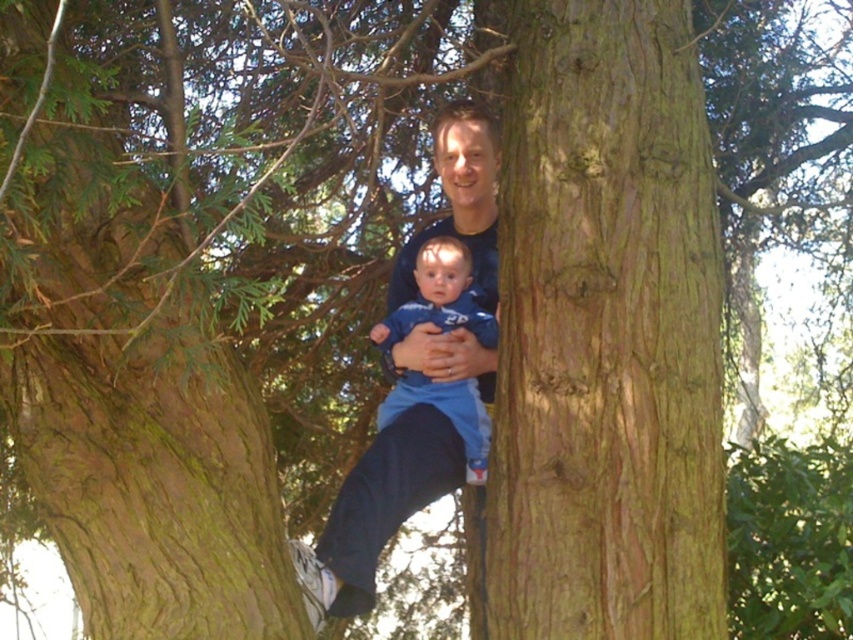
Can you confirm if dark blue shirt at center is shorter than blue soft fabric baby at center?

No.

Based on the photo, does dark blue shirt at center appear on the left side of blue soft fabric baby at center?

Correct, you'll find dark blue shirt at center to the left of blue soft fabric baby at center.

In order to click on dark blue shirt at center in this screenshot , I will do `click(376, 509)`.

The width and height of the screenshot is (853, 640). I want to click on dark blue shirt at center, so click(376, 509).